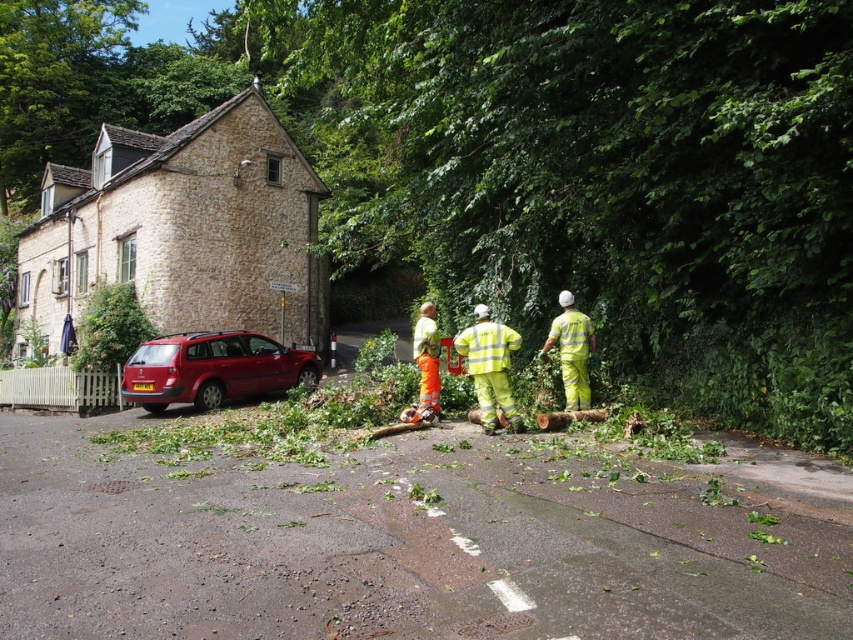
Question: Does yellow reflective uniform at center have a larger size compared to yellow reflective pants at center?

Choices:
 (A) yes
 (B) no

Answer: (A)

Question: Which object appears farthest from the camera in this image?

Choices:
 (A) yellow reflective uniform at center
 (B) shiny metallic car at left

Answer: (B)

Question: Among these points, which one is farthest from the camera?

Choices:
 (A) (219, 403)
 (B) (579, 385)
 (C) (469, 346)
 (D) (389, 154)

Answer: (D)

Question: Does shiny metallic car at left have a greater width compared to yellow reflective pants at center?

Choices:
 (A) no
 (B) yes

Answer: (B)

Question: Which is nearer to the shiny metallic car at left?

Choices:
 (A) yellow reflective uniform at center
 (B) yellow reflective pants at center
 (C) green leafy tree at center

Answer: (A)

Question: Is green leafy tree at center above yellow reflective pants at center?

Choices:
 (A) yes
 (B) no

Answer: (A)